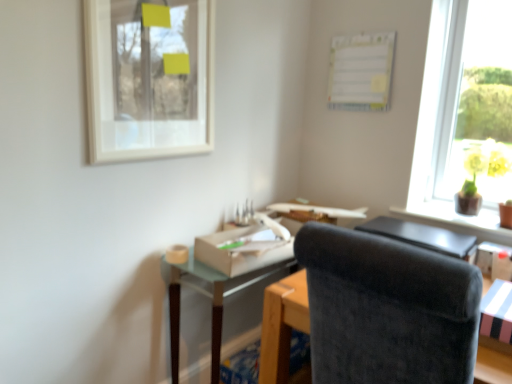
Question: Which direction should I rotate to look at white cardboard box at center, which is the 1th cardboard box in top-to-bottom order, — up or down?

Choices:
 (A) down
 (B) up

Answer: (A)

Question: From the image's perspective, would you say white cardboard box at center, which is the first cardboard box from left to right, is positioned over white matte picture frame at upper left?

Choices:
 (A) yes
 (B) no

Answer: (B)

Question: Does white cardboard box at center, which is the first cardboard box from left to right, appear on the left side of white matte picture frame at upper left?

Choices:
 (A) yes
 (B) no

Answer: (B)

Question: Is white cardboard box at center, arranged as the 1th cardboard box when viewed from the back, aimed at white matte picture frame at upper left?

Choices:
 (A) yes
 (B) no

Answer: (B)

Question: From a real-world perspective, is white cardboard box at center, which is the 1th cardboard box in top-to-bottom order, on white matte picture frame at upper left?

Choices:
 (A) no
 (B) yes

Answer: (A)

Question: Is white cardboard box at center, which is the first cardboard box from left to right, positioned far away from white matte picture frame at upper left?

Choices:
 (A) no
 (B) yes

Answer: (A)

Question: Can you confirm if white cardboard box at center, acting as the 2th cardboard box starting from the bottom, is wider than white matte picture frame at upper left?

Choices:
 (A) no
 (B) yes

Answer: (B)

Question: From a real-world perspective, is white cardboard box at center, acting as the 2th cardboard box starting from the bottom, physically above black leather table at right, which is the first table in right-to-left order?

Choices:
 (A) no
 (B) yes

Answer: (B)

Question: Does white cardboard box at center, placed as the 2th cardboard box when sorted from front to back, appear on the right side of black leather table at right, which is the first table in right-to-left order?

Choices:
 (A) yes
 (B) no

Answer: (B)

Question: Is white cardboard box at center, acting as the 2th cardboard box starting from the bottom, oriented away from black leather table at right, which is the first table in right-to-left order?

Choices:
 (A) no
 (B) yes

Answer: (B)

Question: Is white cardboard box at center, acting as the 2th cardboard box starting from the bottom, positioned far away from black leather table at right, which is the first table in right-to-left order?

Choices:
 (A) yes
 (B) no

Answer: (B)

Question: Considering the relative sizes of white cardboard box at center, which is the first cardboard box from left to right, and black leather table at right, the 2th table when ordered from left to right, in the image provided, is white cardboard box at center, which is the first cardboard box from left to right, wider than black leather table at right, the 2th table when ordered from left to right,?

Choices:
 (A) no
 (B) yes

Answer: (A)

Question: Is white cardboard box at center, which is the 1th cardboard box in top-to-bottom order, behind black leather table at right, the 2th table when ordered from left to right?

Choices:
 (A) yes
 (B) no

Answer: (B)

Question: Is yellow glossy vase at upper right thinner than white paperboard at upper center?

Choices:
 (A) no
 (B) yes

Answer: (A)